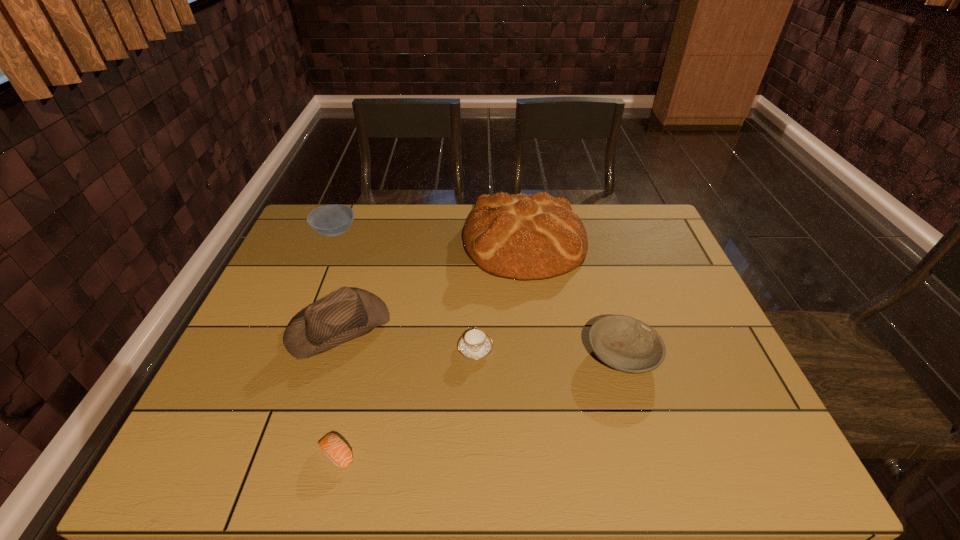
The width and height of the screenshot is (960, 540). Identify the location of fedora that is at the left edge. (347, 313).

Where is `bowl that is at the left edge`? bowl that is at the left edge is located at coordinates (331, 220).

Find the location of a particular element. The image size is (960, 540). object that is at the far left corner is located at coordinates (331, 220).

You are a GUI agent. You are given a task and a screenshot of the screen. Output one action in this format:
    pyautogui.click(x=<x>, y=<y>)
    Task: Click on the blank space at the far edge
    The width and height of the screenshot is (960, 540).
    Given the screenshot: What is the action you would take?
    pyautogui.click(x=421, y=240)

I want to click on vacant space at the near edge of the desktop, so pyautogui.click(x=558, y=462).

At what (x,y) coordinates should I click in order to perform the action: click on free region at the left edge of the desktop. Please return your answer as a coordinate pair (x, y). Looking at the image, I should click on (227, 373).

Identify the location of vacant position at the right edge of the desktop. (668, 322).

In the image, there is a desktop. At what (x,y) coordinates should I click in order to perform the action: click on free space at the near left corner. Please return your answer as a coordinate pair (x, y). Looking at the image, I should click on (204, 433).

This screenshot has width=960, height=540. What are the coordinates of `vacant space in between the nearest object and the tallest object` in the screenshot? It's located at (430, 348).

You are a GUI agent. You are given a task and a screenshot of the screen. Output one action in this format:
    pyautogui.click(x=<x>, y=<y>)
    Task: Click on the vacant area between the shorter bowl and the second shortest object
    This screenshot has height=540, width=960.
    Given the screenshot: What is the action you would take?
    pyautogui.click(x=549, y=352)